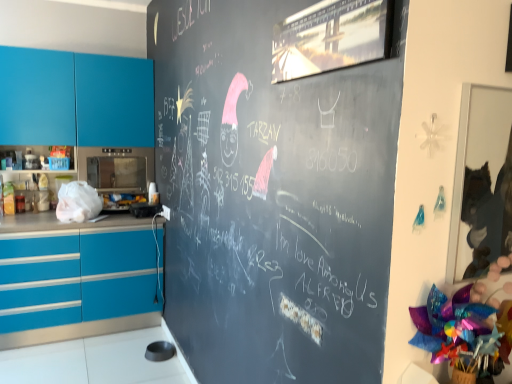
What do you see at coordinates (144, 209) in the screenshot? I see `metallic microwave at center-left, marked as the second appliance in a top-to-bottom arrangement` at bounding box center [144, 209].

Find the location of a particular element. satin silver microwave at left, which ranks as the 1th appliance in top-to-bottom order is located at coordinates (113, 155).

From the image's perspective, is satin silver microwave at left, which ranks as the 1th appliance in top-to-bottom order, on top of teal glossy cabinets at left?

No, from the image's perspective, satin silver microwave at left, which ranks as the 1th appliance in top-to-bottom order, is not over teal glossy cabinets at left.

Can you confirm if satin silver microwave at left, which ranks as the 1th appliance in top-to-bottom order, is wider than teal glossy cabinets at left?

Yes, satin silver microwave at left, which ranks as the 1th appliance in top-to-bottom order, is wider than teal glossy cabinets at left.

Is satin silver microwave at left, which ranks as the 1th appliance in top-to-bottom order, bigger than teal glossy cabinets at left?

Incorrect, satin silver microwave at left, which ranks as the 1th appliance in top-to-bottom order, is not larger than teal glossy cabinets at left.

Can you confirm if teal glossy cabinets at left is thinner than metallic microwave at center-left, marked as the second appliance in a top-to-bottom arrangement?

In fact, teal glossy cabinets at left might be wider than metallic microwave at center-left, marked as the second appliance in a top-to-bottom arrangement.

Is teal glossy cabinets at left positioned with its back to metallic microwave at center-left, marked as the second appliance in a top-to-bottom arrangement?

That's not correct — teal glossy cabinets at left is not looking away from metallic microwave at center-left, marked as the second appliance in a top-to-bottom arrangement.

Measure the distance from teal glossy cabinets at left to metallic microwave at center-left, marked as the first appliance in a bottom-to-top arrangement.

A distance of 37.03 inches exists between teal glossy cabinets at left and metallic microwave at center-left, marked as the first appliance in a bottom-to-top arrangement.

Which is in front, point (12, 61) or point (136, 213)?

The point (12, 61) is in front.

Which object is positioned more to the right, metallic microwave at center-left, marked as the second appliance in a top-to-bottom arrangement, or teal glossy cabinets at left?

Positioned to the right is metallic microwave at center-left, marked as the second appliance in a top-to-bottom arrangement.

Looking at this image, is metallic microwave at center-left, marked as the second appliance in a top-to-bottom arrangement, in front of teal glossy cabinets at left?

No, it is not.

At what (x,y) coordinates should I click in order to perform the action: click on cabinetry above the metallic microwave at center-left, marked as the first appliance in a bottom-to-top arrangement (from a real-world perspective). Please return your answer as a coordinate pair (x, y). Image resolution: width=512 pixels, height=384 pixels. Looking at the image, I should click on (75, 99).

Does metallic microwave at center-left, marked as the first appliance in a bottom-to-top arrangement, have a smaller size compared to teal glossy cabinets at left?

Correct, metallic microwave at center-left, marked as the first appliance in a bottom-to-top arrangement, occupies less space than teal glossy cabinets at left.

Is satin silver microwave at left, which ranks as the 1th appliance in top-to-bottom order, at the back of metallic microwave at center-left, marked as the first appliance in a bottom-to-top arrangement?

No, satin silver microwave at left, which ranks as the 1th appliance in top-to-bottom order, is not at the back of metallic microwave at center-left, marked as the first appliance in a bottom-to-top arrangement.

Does metallic microwave at center-left, marked as the second appliance in a top-to-bottom arrangement, have a lesser width compared to satin silver microwave at left, which ranks as the 1th appliance in top-to-bottom order?

Correct, the width of metallic microwave at center-left, marked as the second appliance in a top-to-bottom arrangement, is less than that of satin silver microwave at left, which ranks as the 1th appliance in top-to-bottom order.

Looking at this image, from the image's perspective, relative to satin silver microwave at left, which ranks as the 1th appliance in top-to-bottom order, is metallic microwave at center-left, marked as the second appliance in a top-to-bottom arrangement, above or below?

metallic microwave at center-left, marked as the second appliance in a top-to-bottom arrangement, is below satin silver microwave at left, which ranks as the 1th appliance in top-to-bottom order.

Which point is more forward, (136,209) or (121,148)?

The point (136,209) is in front.

Considering their positions, is satin silver microwave at left, which ranks as the 1th appliance in top-to-bottom order, located in front of or behind metallic microwave at center-left, marked as the first appliance in a bottom-to-top arrangement?

satin silver microwave at left, which ranks as the 1th appliance in top-to-bottom order, is positioned farther from the viewer than metallic microwave at center-left, marked as the first appliance in a bottom-to-top arrangement.

Is satin silver microwave at left, which ranks as the 1th appliance in top-to-bottom order, directly adjacent to metallic microwave at center-left, marked as the second appliance in a top-to-bottom arrangement?

No, satin silver microwave at left, which ranks as the 1th appliance in top-to-bottom order, is not making contact with metallic microwave at center-left, marked as the second appliance in a top-to-bottom arrangement.

Is satin silver microwave at left, which ranks as the 1th appliance in top-to-bottom order, aimed at metallic microwave at center-left, marked as the second appliance in a top-to-bottom arrangement?

No, satin silver microwave at left, which ranks as the 1th appliance in top-to-bottom order, is not aimed at metallic microwave at center-left, marked as the second appliance in a top-to-bottom arrangement.

Which object is positioned more to the right, satin silver microwave at left, the second appliance ordered from the bottom, or metallic microwave at center-left, marked as the first appliance in a bottom-to-top arrangement?

From the viewer's perspective, metallic microwave at center-left, marked as the first appliance in a bottom-to-top arrangement, appears more on the right side.

Does teal glossy cabinets at left appear on the right side of satin silver microwave at left, which ranks as the 1th appliance in top-to-bottom order?

Incorrect, teal glossy cabinets at left is not on the right side of satin silver microwave at left, which ranks as the 1th appliance in top-to-bottom order.

From a real-world perspective, which is physically below, teal glossy cabinets at left or satin silver microwave at left, the second appliance ordered from the bottom?

From a 3D spatial view, satin silver microwave at left, the second appliance ordered from the bottom, is below.

Does teal glossy cabinets at left come in front of satin silver microwave at left, the second appliance ordered from the bottom?

Yes.

Consider the image. Is teal glossy cabinets at left not near satin silver microwave at left, which ranks as the 1th appliance in top-to-bottom order?

They are positioned close to each other.

I want to click on cabinetry lying above the satin silver microwave at left, which ranks as the 1th appliance in top-to-bottom order (from the image's perspective), so click(x=75, y=99).

The image size is (512, 384). Find the location of `the 2nd appliance counting from the right side of the teal glossy cabinets at left`. the 2nd appliance counting from the right side of the teal glossy cabinets at left is located at coordinates (144, 209).

Based on the photo, which object lies further to the anchor point metallic microwave at center-left, marked as the first appliance in a bottom-to-top arrangement, teal glossy cabinets at left or satin silver microwave at left, which ranks as the 1th appliance in top-to-bottom order?

→ teal glossy cabinets at left is further to metallic microwave at center-left, marked as the first appliance in a bottom-to-top arrangement.

When comparing their distances from metallic microwave at center-left, marked as the first appliance in a bottom-to-top arrangement, does satin silver microwave at left, which ranks as the 1th appliance in top-to-bottom order, or teal glossy cabinets at left seem further?

teal glossy cabinets at left.

When comparing their distances from satin silver microwave at left, the second appliance ordered from the bottom, does teal glossy cabinets at left or metallic microwave at center-left, marked as the first appliance in a bottom-to-top arrangement, seem closer?

teal glossy cabinets at left.

Based on their spatial positions, is satin silver microwave at left, the second appliance ordered from the bottom, or metallic microwave at center-left, marked as the first appliance in a bottom-to-top arrangement, closer to teal glossy cabinets at left?

satin silver microwave at left, the second appliance ordered from the bottom, is closer to teal glossy cabinets at left.

Based on their spatial positions, is metallic microwave at center-left, marked as the first appliance in a bottom-to-top arrangement, or satin silver microwave at left, the second appliance ordered from the bottom, further from teal glossy cabinets at left?

metallic microwave at center-left, marked as the first appliance in a bottom-to-top arrangement.

Which object lies further to the anchor point satin silver microwave at left, which ranks as the 1th appliance in top-to-bottom order, metallic microwave at center-left, marked as the second appliance in a top-to-bottom arrangement, or teal glossy cabinets at left?

Based on the image, metallic microwave at center-left, marked as the second appliance in a top-to-bottom arrangement, appears to be further to satin silver microwave at left, which ranks as the 1th appliance in top-to-bottom order.

The image size is (512, 384). Identify the location of appliance between teal glossy cabinets at left and metallic microwave at center-left, marked as the first appliance in a bottom-to-top arrangement, from top to bottom. (113, 155).